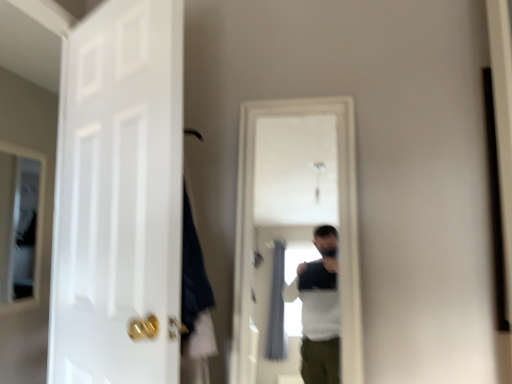
Measure the distance between point (163, 195) and camera.

Point (163, 195) and camera are 1.10 meters apart.

This screenshot has width=512, height=384. Identify the location of white glossy door at left. (119, 198).

Describe the element at coordinates (119, 198) in the screenshot. I see `white glossy door at left` at that location.

The height and width of the screenshot is (384, 512). Find the location of `white glossy door at left`. white glossy door at left is located at coordinates (119, 198).